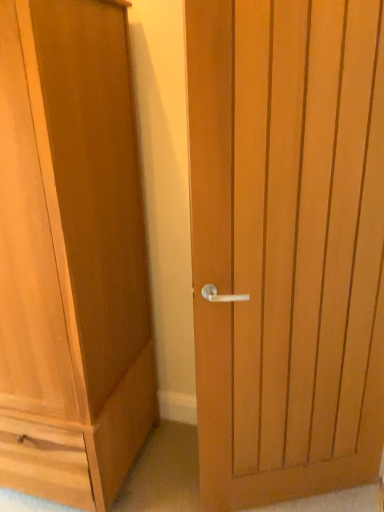
In order to click on light brown wood cupboard at left in this screenshot , I will do `click(71, 254)`.

Describe the element at coordinates (71, 254) in the screenshot. I see `light brown wood cupboard at left` at that location.

What do you see at coordinates (287, 245) in the screenshot?
I see `light brown wood door at center` at bounding box center [287, 245].

Where is `light brown wood door at center`? light brown wood door at center is located at coordinates (x=287, y=245).

The height and width of the screenshot is (512, 384). In order to click on light brown wood cupboard at left in this screenshot , I will do `click(71, 254)`.

Considering the relative positions of light brown wood door at center and light brown wood cupboard at left in the image provided, is light brown wood door at center to the right of light brown wood cupboard at left from the viewer's perspective?

Correct, you'll find light brown wood door at center to the right of light brown wood cupboard at left.

Which object is more forward, light brown wood door at center or light brown wood cupboard at left?

light brown wood cupboard at left is in front.

Does point (382, 68) come closer to viewer compared to point (83, 200)?

Yes, it is in front of point (83, 200).

From the image's perspective, between light brown wood door at center and light brown wood cupboard at left, who is located below?

light brown wood door at center appears lower in the image.

From a real-world perspective, who is located higher, light brown wood door at center or light brown wood cupboard at left?

light brown wood cupboard at left.

Looking at their sizes, would you say light brown wood door at center is wider or thinner than light brown wood cupboard at left?

Considering their sizes, light brown wood door at center looks slimmer than light brown wood cupboard at left.

Can you confirm if light brown wood door at center is shorter than light brown wood cupboard at left?

Indeed, light brown wood door at center has a lesser height compared to light brown wood cupboard at left.

Looking at the image, does light brown wood door at center seem bigger or smaller compared to light brown wood cupboard at left?

light brown wood door at center is smaller than light brown wood cupboard at left.

Is light brown wood door at center not inside light brown wood cupboard at left?

Yes, light brown wood door at center is located beyond the bounds of light brown wood cupboard at left.

Are light brown wood door at center and light brown wood cupboard at left beside each other?

No, light brown wood door at center is not in contact with light brown wood cupboard at left.

Is light brown wood door at center facing away from light brown wood cupboard at left?

No, light brown wood door at center's orientation is not away from light brown wood cupboard at left.

Identify the location of door on the right of light brown wood cupboard at left. (287, 245).

In the image, is light brown wood cupboard at left on the left side or the right side of light brown wood door at center?

Clearly, light brown wood cupboard at left is on the left of light brown wood door at center in the image.

Does light brown wood cupboard at left come in front of light brown wood door at center?

Yes, light brown wood cupboard at left is in front of light brown wood door at center.

Which is closer to the camera, (80, 264) or (244, 429)?

The point (80, 264) is in front.

From the image's perspective, which one is positioned lower, light brown wood cupboard at left or light brown wood door at center?

light brown wood door at center appears lower in the image.

From a real-world perspective, between light brown wood cupboard at left and light brown wood door at center, who is vertically lower?

From a 3D spatial view, light brown wood door at center is below.

In the scene shown: Considering the sizes of objects light brown wood cupboard at left and light brown wood door at center in the image provided, who is wider, light brown wood cupboard at left or light brown wood door at center?

With larger width is light brown wood cupboard at left.

Considering the relative sizes of light brown wood cupboard at left and light brown wood door at center in the image provided, is light brown wood cupboard at left taller than light brown wood door at center?

Yes.

Who is bigger, light brown wood cupboard at left or light brown wood door at center?

With larger size is light brown wood cupboard at left.

Can we say light brown wood cupboard at left lies outside light brown wood door at center?

Yes, light brown wood cupboard at left is located beyond the bounds of light brown wood door at center.

Is light brown wood cupboard at left beside light brown wood door at center?

No, light brown wood cupboard at left is not in contact with light brown wood door at center.

Is light brown wood cupboard at left facing towards light brown wood door at center?

No, light brown wood cupboard at left is not facing towards light brown wood door at center.

Can you tell me how much light brown wood cupboard at left and light brown wood door at center differ in facing direction?

light brown wood cupboard at left and light brown wood door at center are facing 26.1 degrees away from each other.

Find the location of `door on the right of light brown wood cupboard at left`. door on the right of light brown wood cupboard at left is located at coordinates (287, 245).

Locate an element on the screen. The height and width of the screenshot is (512, 384). door below the light brown wood cupboard at left (from a real-world perspective) is located at coordinates (287, 245).

There is a light brown wood door at center. Identify the location of cupboard above it (from a real-world perspective). (71, 254).